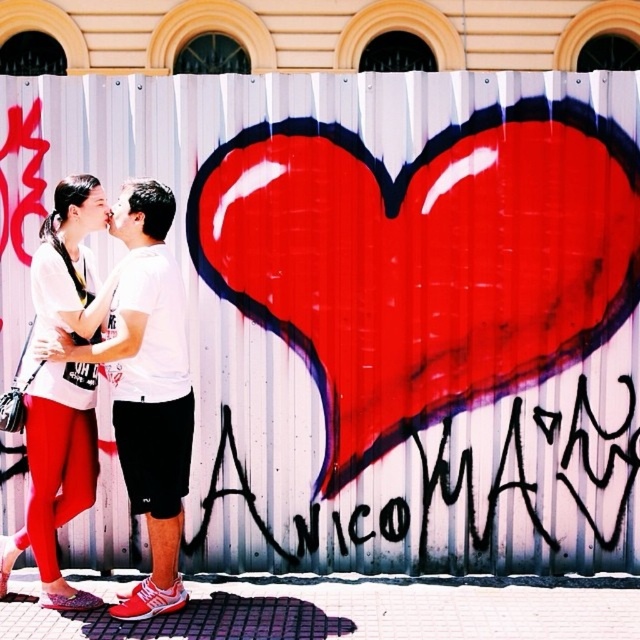
Question: Which object appears closest to the camera in this image?

Choices:
 (A) white matte t-shirt at center
 (B) matte white shirt at left

Answer: (A)

Question: Can you confirm if white matte t-shirt at center is positioned to the right of matte white shirt at left?

Choices:
 (A) no
 (B) yes

Answer: (B)

Question: Is white matte t-shirt at center bigger than matte white shirt at left?

Choices:
 (A) yes
 (B) no

Answer: (B)

Question: Which point appears farthest from the camera in this image?

Choices:
 (A) (97, 301)
 (B) (124, 432)

Answer: (B)

Question: Is white matte t-shirt at center to the right of matte white shirt at left from the viewer's perspective?

Choices:
 (A) yes
 (B) no

Answer: (A)